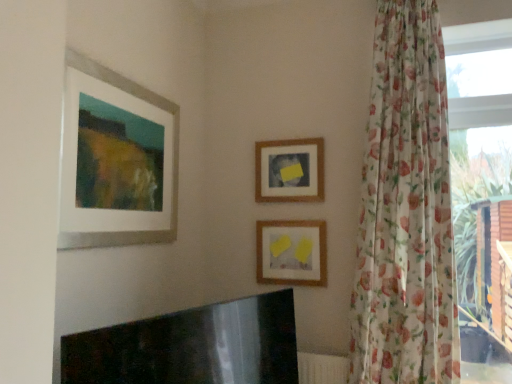
Question: From the image's perspective, is transparent floral curtain at right located above or below wooden frame at center, arranged as the third picture frame when viewed from the front?

Choices:
 (A) below
 (B) above

Answer: (A)

Question: Visually, is transparent floral curtain at right positioned to the left or to the right of wooden frame at center, marked as the first picture frame in a back-to-front arrangement?

Choices:
 (A) right
 (B) left

Answer: (A)

Question: Which object is the closest to the floral sheer curtain at right?

Choices:
 (A) transparent floral curtain at right
 (B) matte white picture frame at upper left, which appears as the third picture frame when viewed from the right
 (C) matte paper picture frame at center, positioned as the first picture frame in right-to-left order
 (D) wooden frame at center, the second picture frame from the right

Answer: (A)

Question: Considering the real-world distances, which object is farthest from the transparent floral curtain at right?

Choices:
 (A) wooden frame at center, the second picture frame from the right
 (B) matte white picture frame at upper left, which appears as the third picture frame when viewed from the right
 (C) floral sheer curtain at right
 (D) matte paper picture frame at center, positioned as the first picture frame in right-to-left order

Answer: (B)